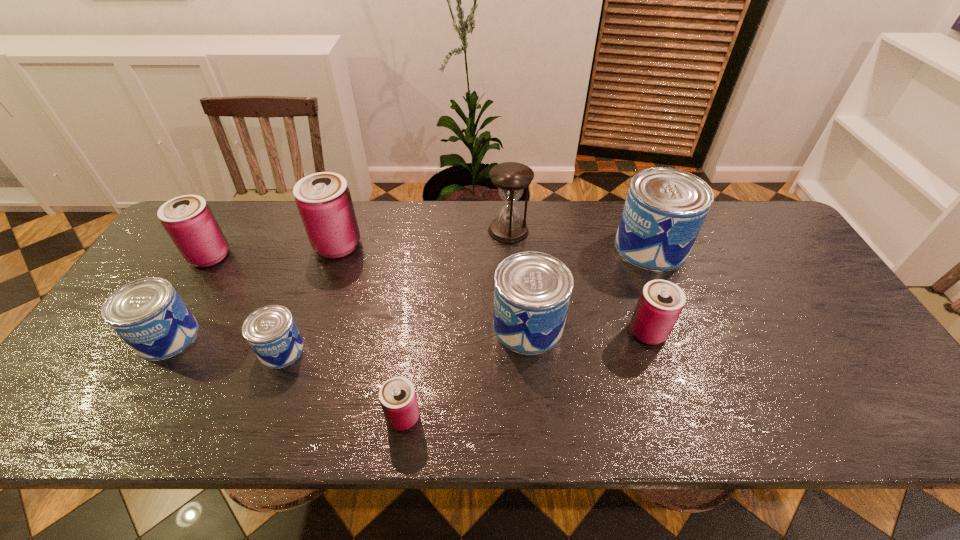
This screenshot has height=540, width=960. Find the location of `the biggest pink can`. the biggest pink can is located at coordinates (323, 199).

Locate an element on the screen. the rightmost blue can is located at coordinates (665, 208).

Find the location of a particular element. the farthest blue can is located at coordinates (665, 208).

Image resolution: width=960 pixels, height=540 pixels. Identify the location of hourglass. (511, 178).

The width and height of the screenshot is (960, 540). I want to click on the second biggest pink can, so click(188, 220).

What are the coordinates of `the second biggest blue can` in the screenshot? It's located at [532, 290].

Identify the location of the sixth can from left to right. (532, 290).

Locate an element on the screen. the third farthest pink can is located at coordinates (661, 302).

This screenshot has height=540, width=960. In order to click on the second smallest pink can in this screenshot , I will do `click(661, 302)`.

Find the location of `the second smallest blue can`. the second smallest blue can is located at coordinates (148, 314).